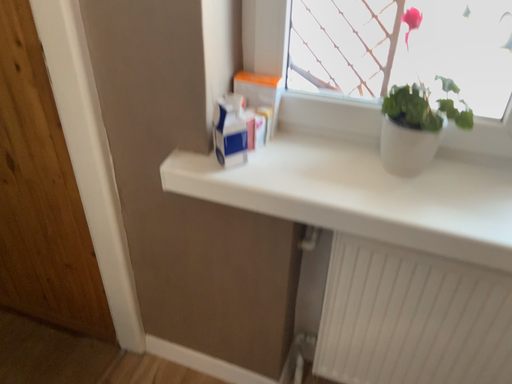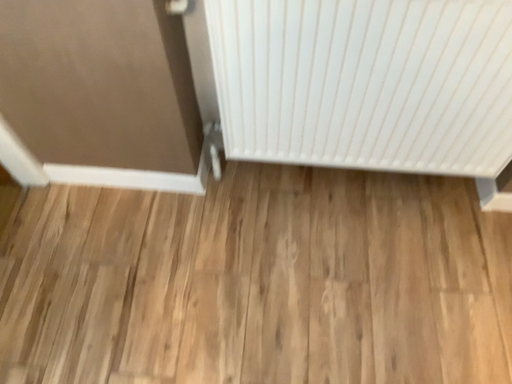
Question: How did the camera likely rotate when shooting the video?

Choices:
 (A) rotated left
 (B) rotated right

Answer: (B)